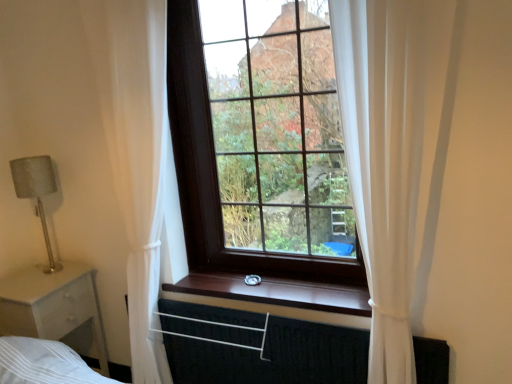
Question: Considering the relative sizes of black fabric canopy bed at lower center and wooden at center in the image provided, is black fabric canopy bed at lower center wider than wooden at center?

Choices:
 (A) yes
 (B) no

Answer: (B)

Question: Does black fabric canopy bed at lower center have a larger size compared to wooden at center?

Choices:
 (A) no
 (B) yes

Answer: (B)

Question: Does black fabric canopy bed at lower center come in front of wooden at center?

Choices:
 (A) no
 (B) yes

Answer: (B)

Question: Is black fabric canopy bed at lower center behind wooden at center?

Choices:
 (A) no
 (B) yes

Answer: (A)

Question: From a real-world perspective, is black fabric canopy bed at lower center beneath wooden at center?

Choices:
 (A) yes
 (B) no

Answer: (A)

Question: Is point (295, 249) positioned closer to the camera than point (44, 223)?

Choices:
 (A) farther
 (B) closer

Answer: (B)

Question: Based on their positions, is dark wood window at center located to the left or right of satin silver lamp at left?

Choices:
 (A) left
 (B) right

Answer: (B)

Question: Looking at their shapes, would you say dark wood window at center is wider or thinner than satin silver lamp at left?

Choices:
 (A) wide
 (B) thin

Answer: (A)

Question: From the image's perspective, is dark wood window at center positioned above or below satin silver lamp at left?

Choices:
 (A) below
 (B) above

Answer: (B)

Question: Is satin silver lamp at left in front of or behind black fabric canopy bed at lower center in the image?

Choices:
 (A) behind
 (B) front

Answer: (A)

Question: Considering the positions of satin silver lamp at left and black fabric canopy bed at lower center in the image, is satin silver lamp at left taller or shorter than black fabric canopy bed at lower center?

Choices:
 (A) tall
 (B) short

Answer: (A)

Question: In terms of width, does satin silver lamp at left look wider or thinner when compared to black fabric canopy bed at lower center?

Choices:
 (A) thin
 (B) wide

Answer: (B)

Question: From a real-world perspective, is satin silver lamp at left above or below black fabric canopy bed at lower center?

Choices:
 (A) above
 (B) below

Answer: (A)

Question: Is white matte nightstand at left in front of or behind black fabric canopy bed at lower center in the image?

Choices:
 (A) front
 (B) behind

Answer: (B)

Question: In the image, is white matte nightstand at left on the left side or the right side of black fabric canopy bed at lower center?

Choices:
 (A) right
 (B) left

Answer: (B)